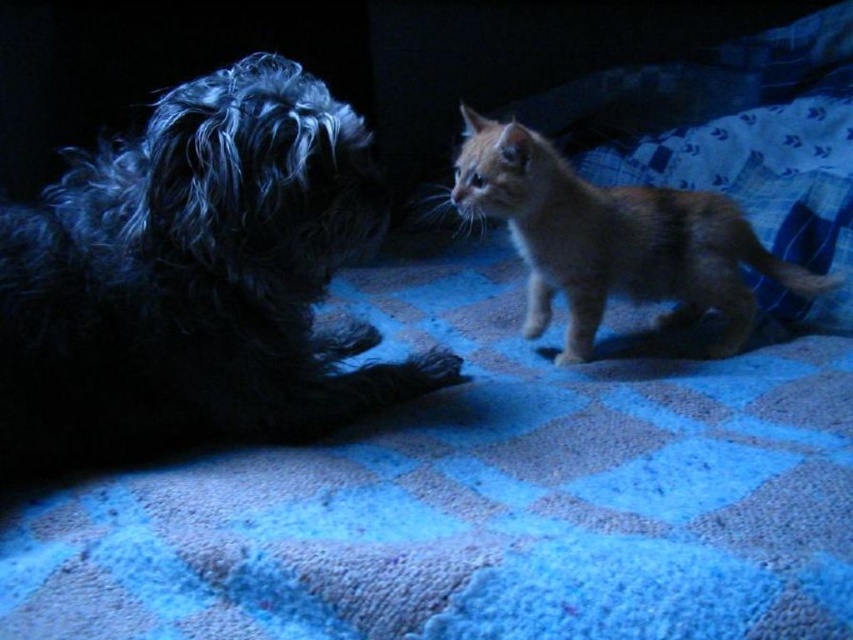
Which is more to the right, shaggy black dog at left or orange fur cat at center?

From the viewer's perspective, orange fur cat at center appears more on the right side.

Locate an element on the screen. The height and width of the screenshot is (640, 853). shaggy black dog at left is located at coordinates (195, 278).